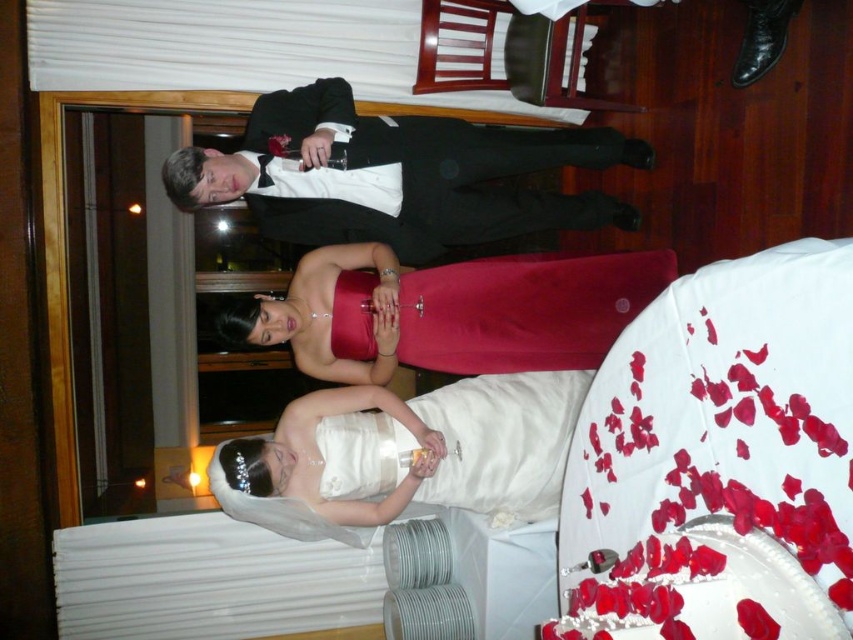
You are at the wedding reception and want to take a photo of the three people standing in the center. You notice two points marked in the image, point 1 at coordinates point (350, 188) and point 2 at coordinates point (351, 445). Which point is closer to the photographer if the photographer is positioned at the same level as the people?

Point (351, 445) is closer to the photographer because point (350, 188) is behind it.

You are a photographer at the wedding reception. You need to capture a photo of both the satin red dress at center and the white satin dress at lower center. Since you can only focus on one subject at a time, which dress should you focus on to ensure the other is still in the background?

You should focus on the satin red dress at center because it is closer to you than the white satin dress at lower center, so the white satin dress will naturally appear in the background.

You are a photographer at a wedding reception. You want to capture a candid shot of the black satin tuxedo at upper center and the white satin dress at lower center. Given that your camera has a maximum focus range of 30 inches, will you be able to capture both subjects clearly in the same frame?

The black satin tuxedo at upper center and white satin dress at lower center are 32.22 inches apart, which exceeds the camera maximum focus range of 30 inches. Therefore, you cannot capture both subjects clearly in the same frame.